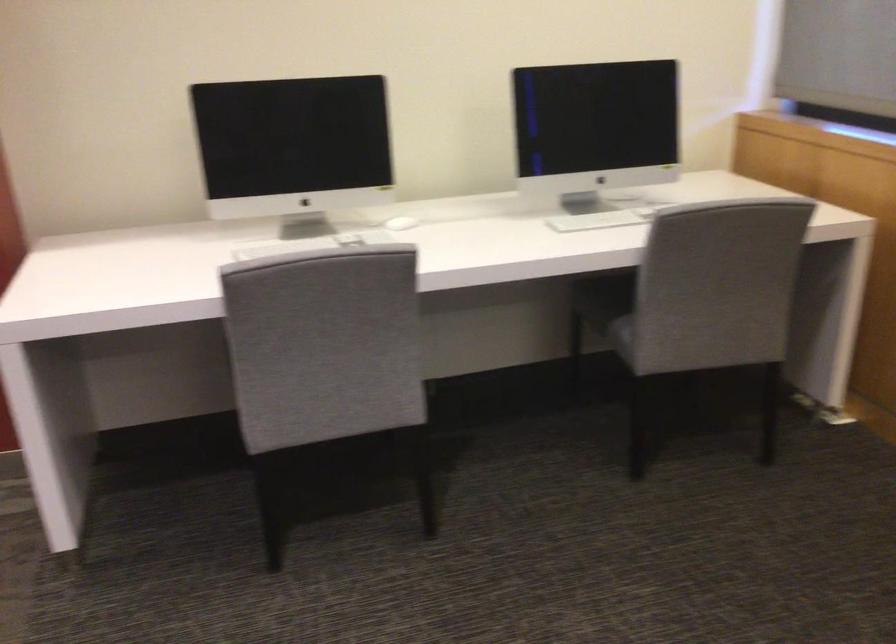
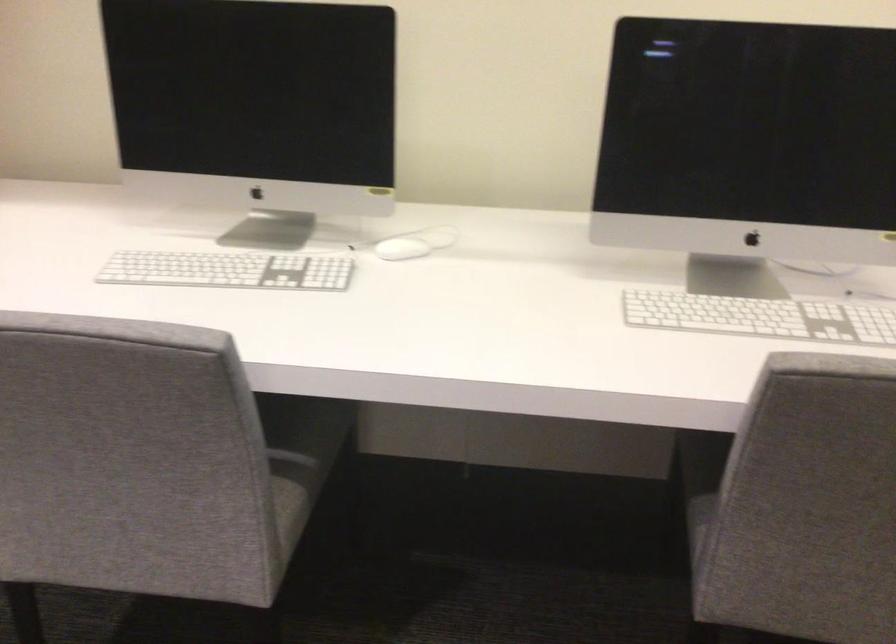
The point at (380, 351) is marked in the first image. Where is the corresponding point in the second image?

(291, 456)